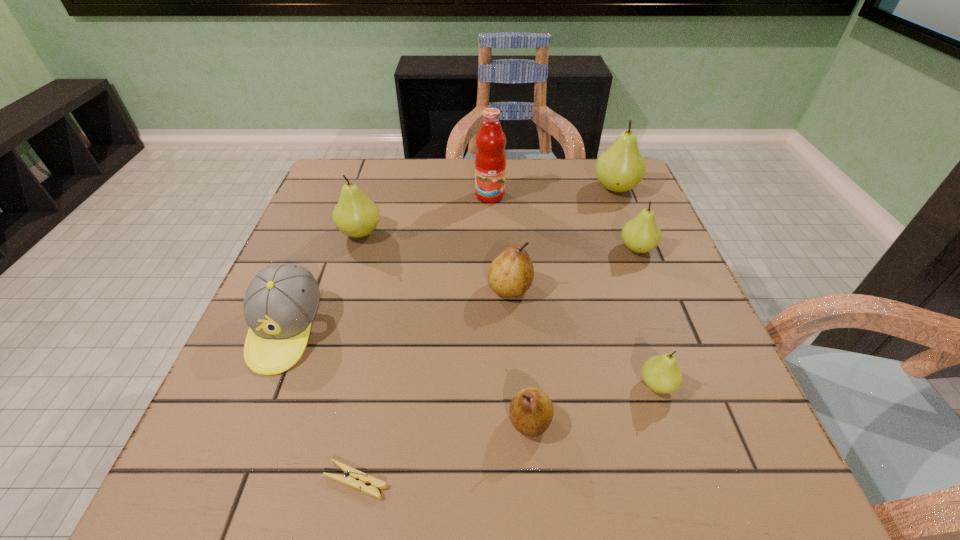
Find the location of `the smallest green pear`. the smallest green pear is located at coordinates [661, 374].

Find the location of `the nearest object`. the nearest object is located at coordinates (356, 479).

The image size is (960, 540). Identify the location of the seventh object from right to left. (356, 479).

This screenshot has width=960, height=540. I want to click on vacant space located 0.400m on the front label of the fruit juice, so click(x=493, y=316).

This screenshot has height=540, width=960. I want to click on vacant space located 0.250m on the left of the biggest green pear, so click(x=503, y=188).

This screenshot has height=540, width=960. I want to click on blank space located on the left of the leftmost pear, so click(x=302, y=233).

Identify the location of free spot located 0.330m on the back of the third biggest green pear. This screenshot has width=960, height=540. (605, 168).

I want to click on vacant space situated 0.250m on the right of the fourth farthest pear, so click(x=647, y=288).

Identify the location of free space located on the front-facing side of the baseball cap. coord(228,477).

At what (x,y) coordinates should I click in order to perform the action: click on free space located on the back of the smaller brown pear. Please return your answer as a coordinate pair (x, y). This screenshot has height=540, width=960. Looking at the image, I should click on (518, 290).